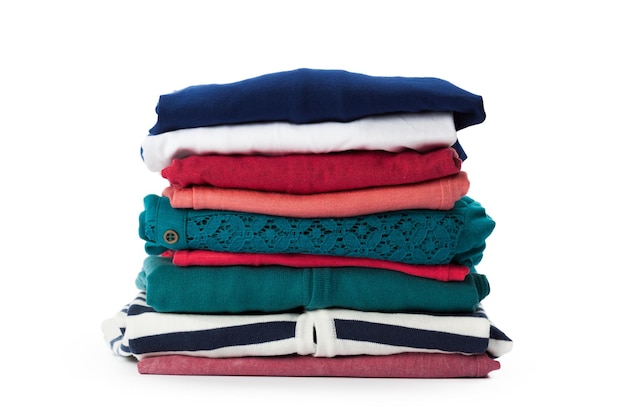
This screenshot has height=417, width=626. What are the coordinates of `folded clothes stacked up` in the screenshot? It's located at (288, 369), (264, 342), (275, 293), (272, 260), (304, 240), (300, 210), (300, 183), (300, 148), (305, 108).